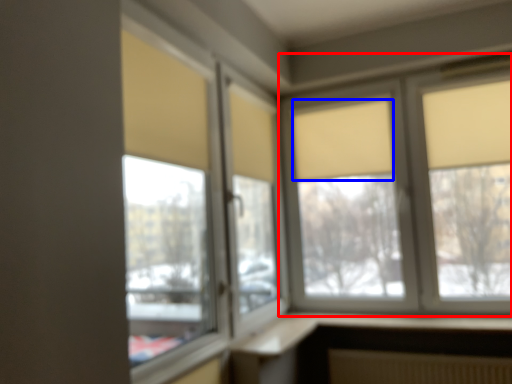
Question: Which point is closer to the camera, window (highlighted by a red box) or curtain (highlighted by a blue box)?

Choices:
 (A) window
 (B) curtain

Answer: (A)